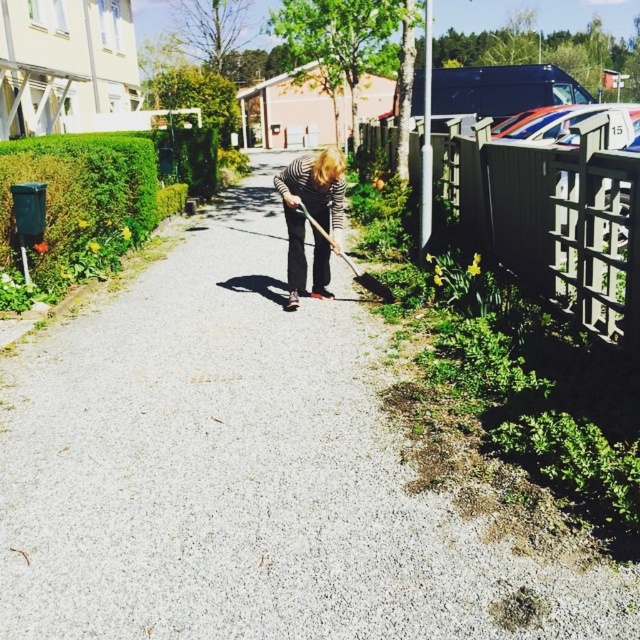
Question: Which is farther from the green leafy hedge at left?

Choices:
 (A) striped fabric person at center
 (B) green metal fence at right

Answer: (B)

Question: Can you confirm if green metal fence at right is positioned above green leafy hedge at left?

Choices:
 (A) no
 (B) yes

Answer: (A)

Question: Is green metal fence at right thinner than green leafy hedge at left?

Choices:
 (A) no
 (B) yes

Answer: (B)

Question: Which of the following is the closest to the observer?

Choices:
 (A) striped fabric person at center
 (B) green leafy hedge at left
 (C) green metal fence at right
 (D) wooden shovel at center

Answer: (C)

Question: Does green metal fence at right have a greater width compared to wooden shovel at center?

Choices:
 (A) yes
 (B) no

Answer: (B)

Question: Which object is closer to the camera taking this photo?

Choices:
 (A) green metal fence at right
 (B) wooden shovel at center
 (C) striped fabric person at center

Answer: (A)